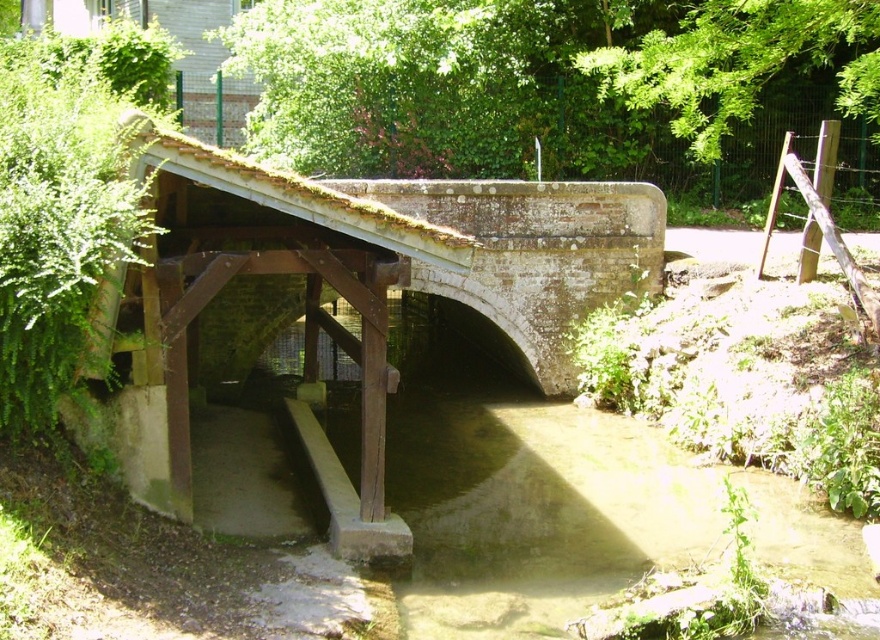
Consider the image. You are standing on a path near the white stone bridge at center and want to cross it. The bridge is 3 meters wide. If you are 1.7 meters tall, will your head hit the wooden beams supporting the arch when walking under them?

The white stone bridge at center is 5.47 meters from viewer, so the distance from the viewer to the bridge is greater than the height of the person. However, the question is about the height of the wooden beams. Since the wooden beams are described as sturdy and part of the support system, but no specific height is given, it is impossible to determine if the head will hit the beams based on the provided information.

You are a hiker crossing the white stone bridge at center. You notice the brown concrete water at center flowing beneath you. Which structure is narrower in width between the two?

The white stone bridge at center is narrower in width compared to the brown concrete water at center.

You are a delivery person carrying a package that requires a path at least 2 meters wide to pass through. You see the white stone bridge at center and the brown concrete water at center in the image. Can you safely navigate through the space between them?

The white stone bridge at center and brown concrete water at center are 1.87 meters apart, which is narrower than the required 2 meters. Therefore, you cannot safely navigate through the space between them.